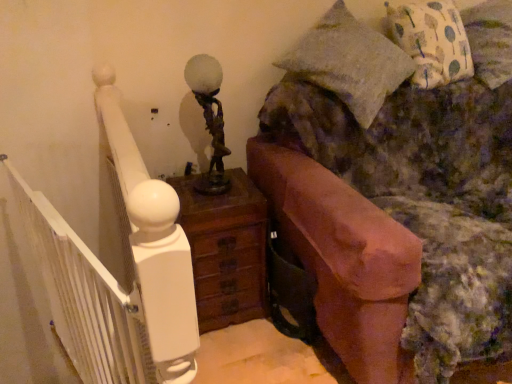
Question: Is terracotta clay fireplace at right shorter than brown wooden nightstand at center?

Choices:
 (A) no
 (B) yes

Answer: (A)

Question: Would you say terracotta clay fireplace at right is outside brown wooden nightstand at center?

Choices:
 (A) no
 (B) yes

Answer: (B)

Question: Considering the relative positions of terracotta clay fireplace at right and brown wooden nightstand at center in the image provided, is terracotta clay fireplace at right behind brown wooden nightstand at center?

Choices:
 (A) no
 (B) yes

Answer: (A)

Question: From a real-world perspective, is terracotta clay fireplace at right positioned over brown wooden nightstand at center based on gravity?

Choices:
 (A) yes
 (B) no

Answer: (A)

Question: Considering the relative positions of terracotta clay fireplace at right and brown wooden nightstand at center in the image provided, is terracotta clay fireplace at right to the right of brown wooden nightstand at center from the viewer's perspective?

Choices:
 (A) no
 (B) yes

Answer: (B)

Question: From a real-world perspective, is white painted wood balustrade at left positioned above or below bronze/antique brass table lamp at center?

Choices:
 (A) above
 (B) below

Answer: (B)

Question: Do you think white painted wood balustrade at left is within bronze/antique brass table lamp at center, or outside of it?

Choices:
 (A) outside
 (B) inside

Answer: (A)

Question: Is white painted wood balustrade at left taller or shorter than bronze/antique brass table lamp at center?

Choices:
 (A) tall
 (B) short

Answer: (A)

Question: From the image's perspective, relative to bronze/antique brass table lamp at center, is white painted wood balustrade at left above or below?

Choices:
 (A) above
 (B) below

Answer: (B)

Question: Is white painted wood balustrade at left in front of or behind terracotta clay fireplace at right in the image?

Choices:
 (A) front
 (B) behind

Answer: (B)

Question: Which is correct: white painted wood balustrade at left is inside terracotta clay fireplace at right, or outside of it?

Choices:
 (A) outside
 (B) inside

Answer: (A)

Question: From a real-world perspective, is white painted wood balustrade at left physically located above or below terracotta clay fireplace at right?

Choices:
 (A) below
 (B) above

Answer: (A)

Question: Is white painted wood balustrade at left to the left or to the right of terracotta clay fireplace at right in the image?

Choices:
 (A) right
 (B) left

Answer: (B)

Question: From their relative heights in the image, would you say printed fabric pillow at upper right is taller or shorter than terracotta clay fireplace at right?

Choices:
 (A) tall
 (B) short

Answer: (B)

Question: Is point (479, 41) closer or farther from the camera than point (507, 259)?

Choices:
 (A) farther
 (B) closer

Answer: (A)